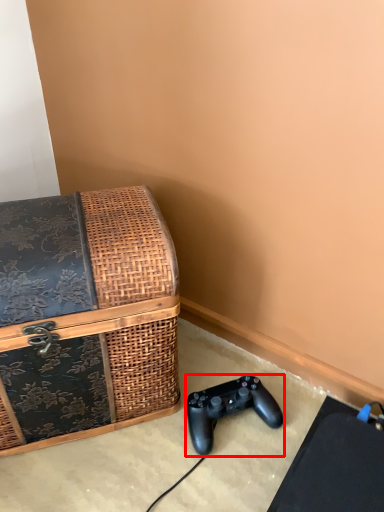
Question: Where is game controller (annotated by the red box) located in relation to box in the image?

Choices:
 (A) right
 (B) left

Answer: (A)